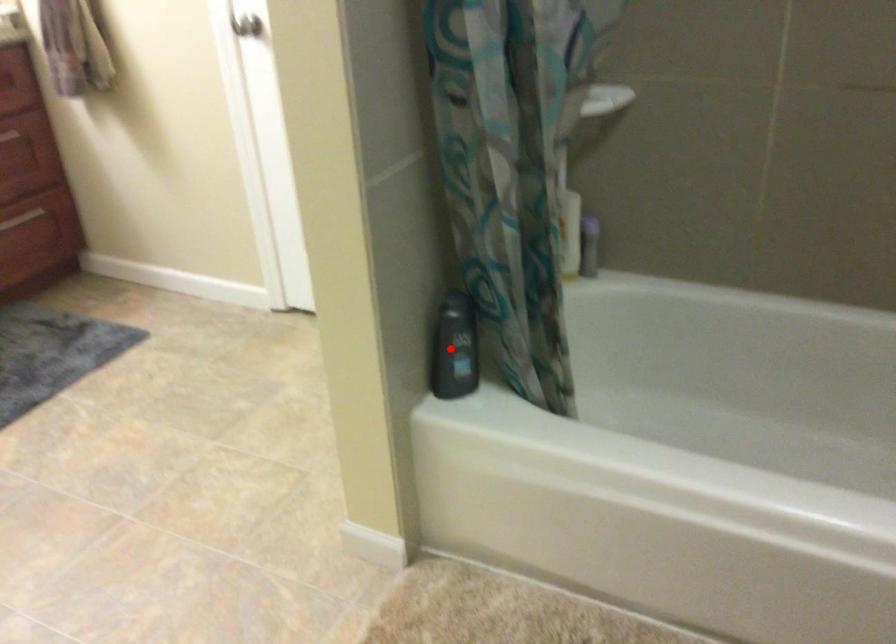
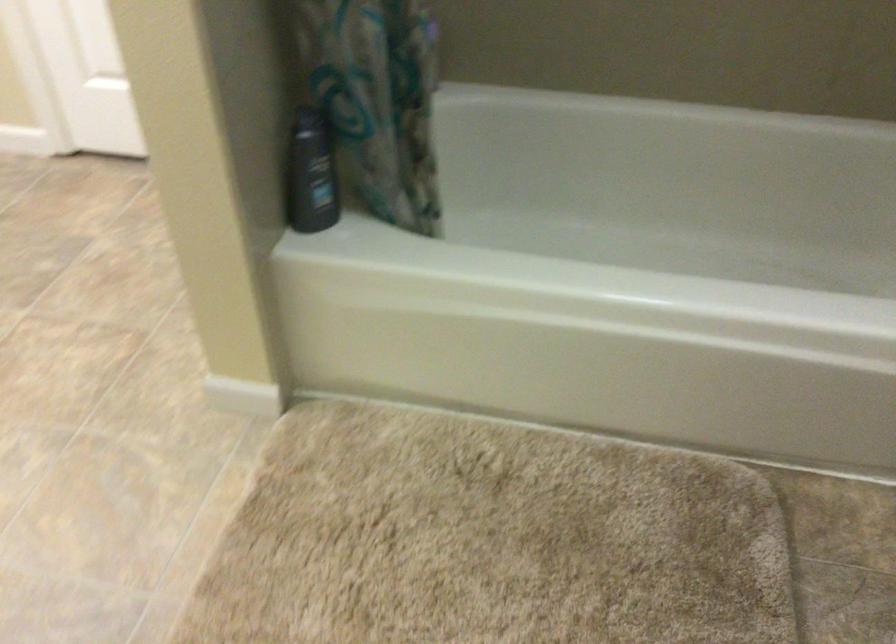
Where in the second image is the point corresponding to the highlighted location from the first image?

(311, 174)